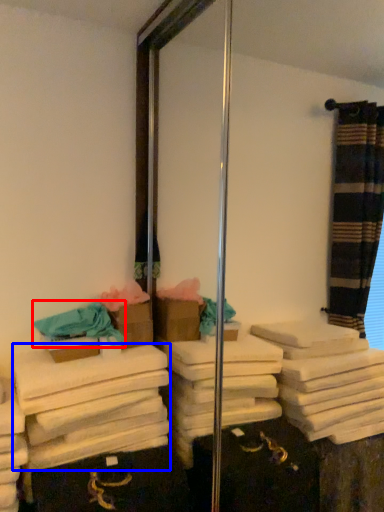
Question: Which point is further to the camera, bath towel (highlighted by a red box) or bath towel (highlighted by a blue box)?

Choices:
 (A) bath towel
 (B) bath towel

Answer: (A)